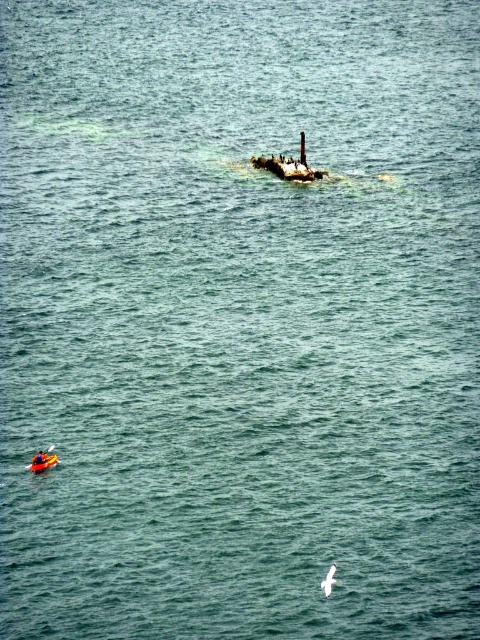
You are a wildlife researcher observing the seascape. You need to launch a small drone from the orange plastic kayak at center to collect data on the white feathered bird at center. What is the minimum distance the drone must be able to fly to reach the bird?

The minimum distance the drone must be able to fly is 10.79 meters to reach the white feathered bird at center from the orange plastic kayak at center.

You are a marine biologist studying shipwrecks in the area. You have a map showing a point at coordinates (289, 164). According to the image, what does this point indicate?

The point at coordinates (289, 164) marks the location of a rusty metal shipwreck at center.

You are a photographer planning to capture the rusty metal shipwreck at center and the white feathered bird at center in a single shot. Based on their sizes in the image, which object should you focus on first to ensure both are in frame?

The rusty metal shipwreck at center occupies less space than the white feathered bird at center, so you should focus on the white feathered bird at center first to ensure both fit in the frame.